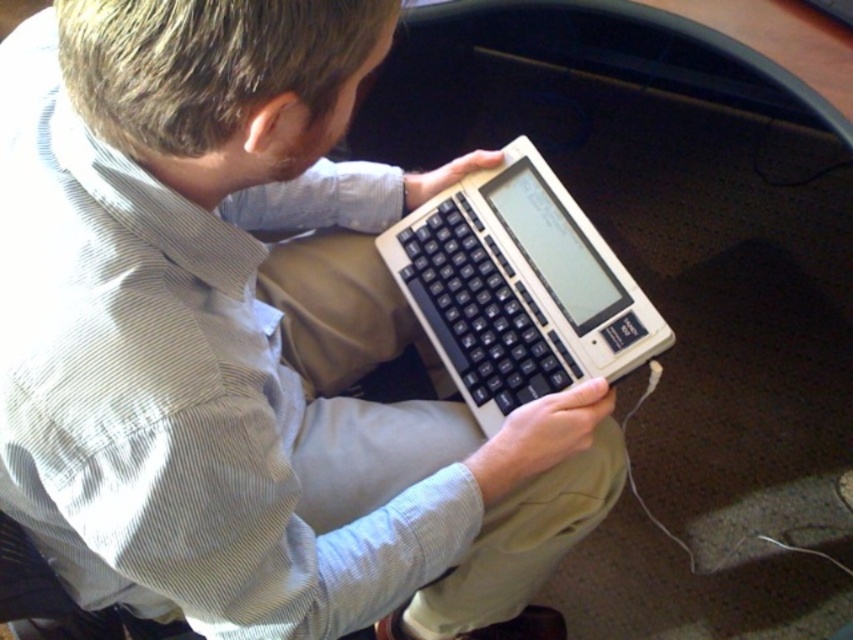
Looking at this image, can you confirm if matte black laptop at center is smaller than white plastic computer at center?

Actually, matte black laptop at center might be larger than white plastic computer at center.

What are the coordinates of `matte black laptop at center` in the screenshot? It's located at (248, 342).